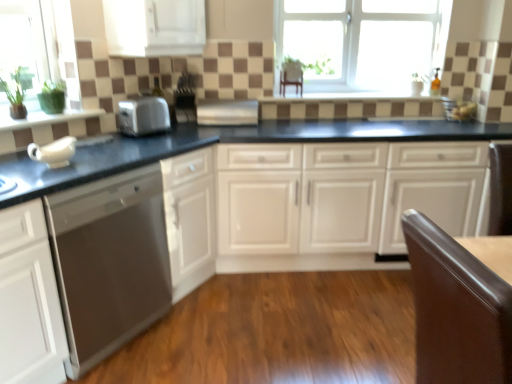
Where is `empty space that is ontop of satin stainless steel dishwasher at left (from a real-world perspective)`? The height and width of the screenshot is (384, 512). empty space that is ontop of satin stainless steel dishwasher at left (from a real-world perspective) is located at coordinates (84, 161).